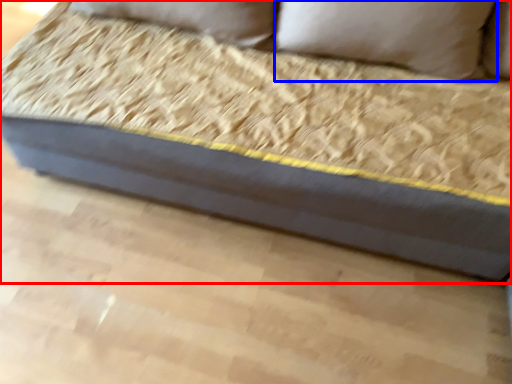
Question: Which object appears farthest to the camera in this image, studio couch (highlighted by a red box) or pillow (highlighted by a blue box)?

Choices:
 (A) studio couch
 (B) pillow

Answer: (B)